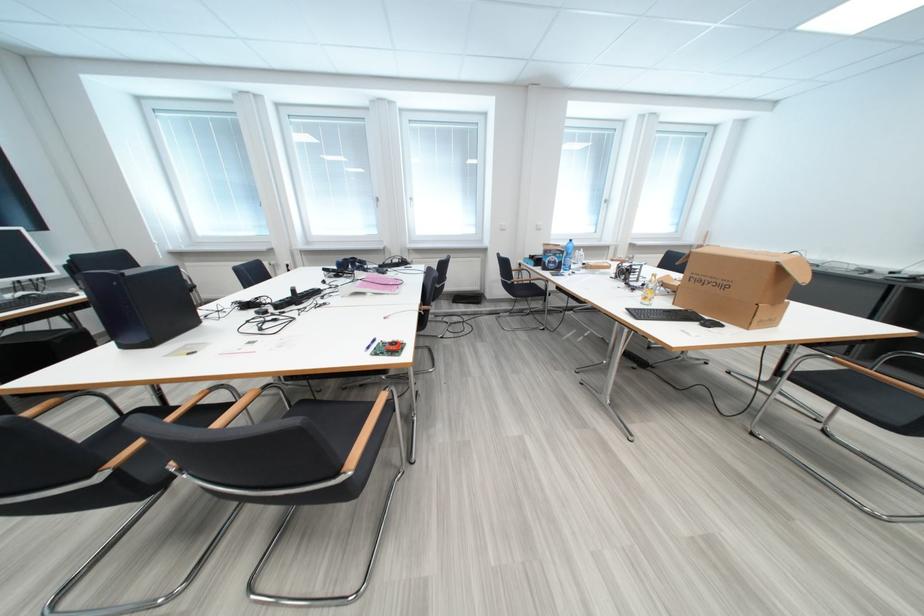
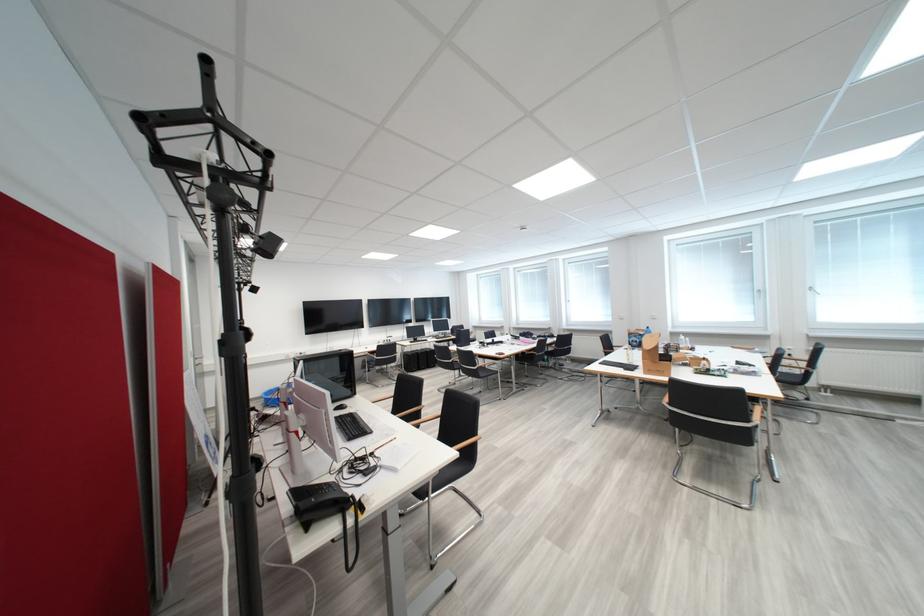
Find the pixel in the second image that matches [573,254] in the first image.

(650, 337)